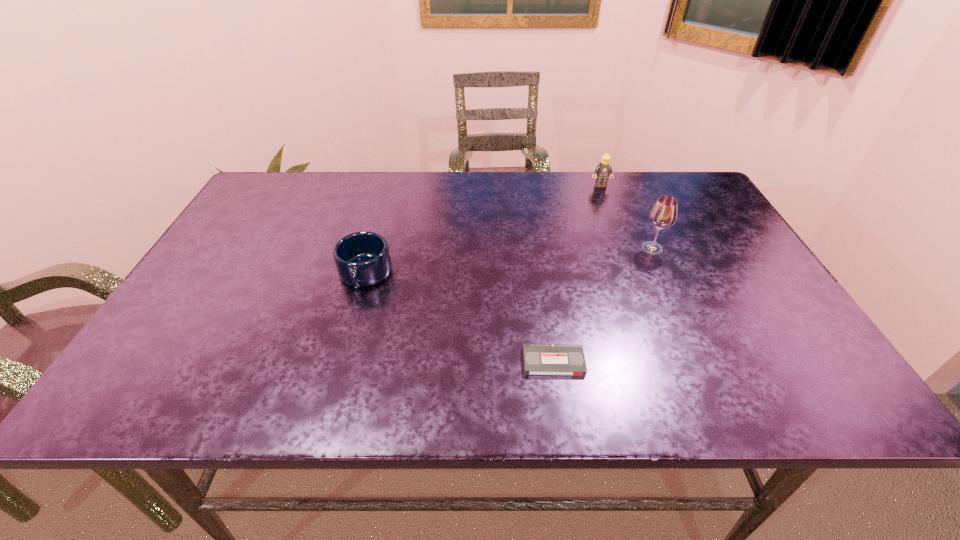
The image size is (960, 540). I want to click on vacant region located with the handle on the side of the second shortest object, so click(344, 351).

At what (x,y) coordinates should I click in order to perform the action: click on free space located 0.110m on the right of the second object from left to right. Please return your answer as a coordinate pair (x, y). Looking at the image, I should click on coord(639,362).

Find the location of `object that is at the far edge`. object that is at the far edge is located at coordinates (603, 170).

Find the location of `object present at the near edge`. object present at the near edge is located at coordinates (539, 359).

Locate an element on the screen. The width and height of the screenshot is (960, 540). vacant area at the far edge of the desktop is located at coordinates (638, 185).

Locate an element on the screen. The height and width of the screenshot is (540, 960). vacant space at the near edge of the desktop is located at coordinates (x=372, y=374).

Where is `vacant space at the left edge of the desktop`? vacant space at the left edge of the desktop is located at coordinates (195, 288).

This screenshot has height=540, width=960. Identify the location of free space at the right edge of the desktop. (684, 225).

This screenshot has width=960, height=540. Find the location of `free location at the far left corner`. free location at the far left corner is located at coordinates (304, 200).

This screenshot has width=960, height=540. I want to click on vacant space at the near right corner of the desktop, so pyautogui.click(x=788, y=394).